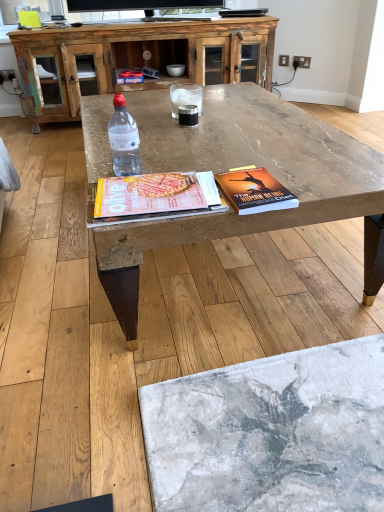
Identify the location of free point below matte paper magazine at center (from a real-world perspective). The image size is (384, 512). (163, 202).